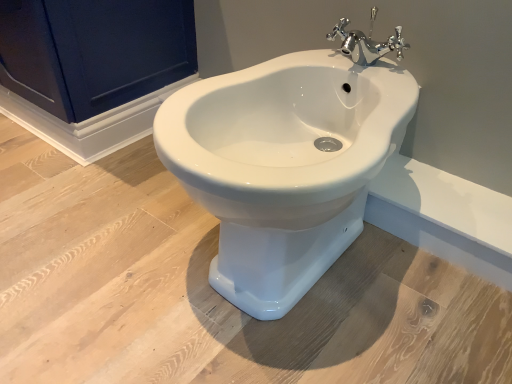
This screenshot has height=384, width=512. In order to click on free space to the left of white glossy bidet at center in this screenshot , I will do `click(105, 244)`.